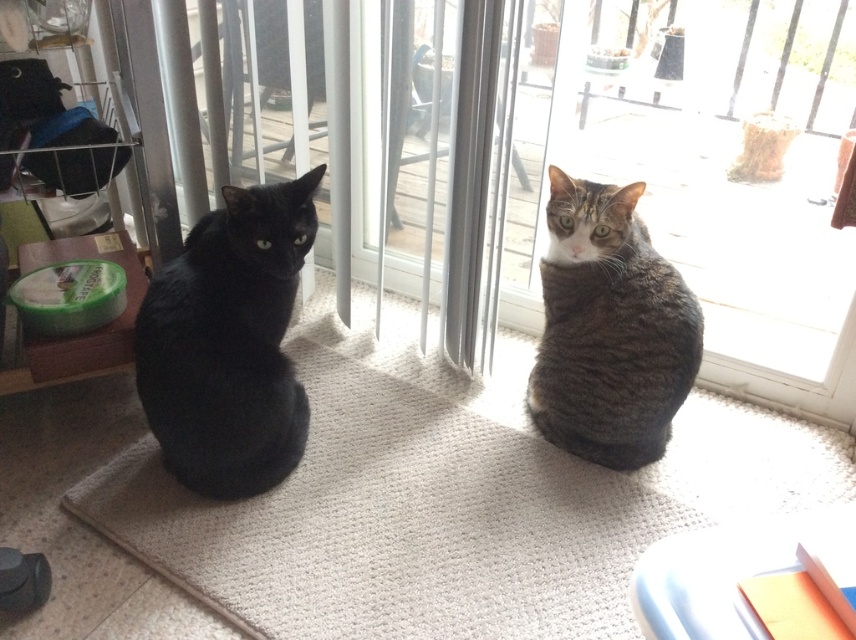
Question: Is matte black cat at left further to camera compared to tabby fur cat at center?

Choices:
 (A) no
 (B) yes

Answer: (A)

Question: Which point is closer to the camera?

Choices:
 (A) (235, 259)
 (B) (646, 356)

Answer: (A)

Question: Does matte black cat at left appear over tabby fur cat at center?

Choices:
 (A) no
 (B) yes

Answer: (A)

Question: Is the position of matte black cat at left less distant than that of tabby fur cat at center?

Choices:
 (A) no
 (B) yes

Answer: (B)